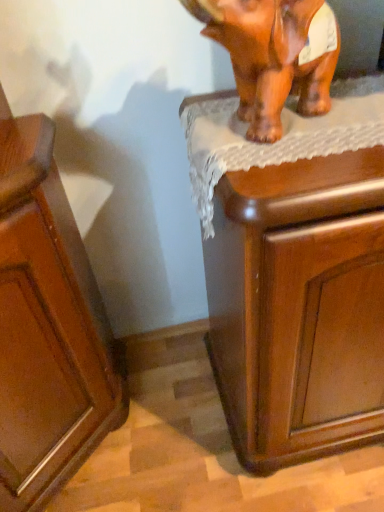
Image resolution: width=384 pixels, height=512 pixels. I want to click on vacant area that is situated to the right of brown glossy elephant at upper right, so click(356, 108).